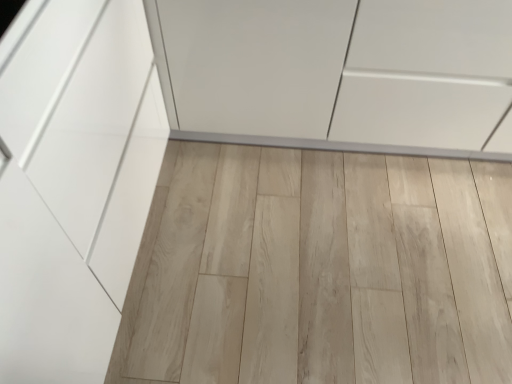
Question: Is white glossy cabinet at center turned away from natural wood plank at center?

Choices:
 (A) yes
 (B) no

Answer: (B)

Question: Is the depth of white glossy cabinet at center less than that of natural wood plank at center?

Choices:
 (A) yes
 (B) no

Answer: (A)

Question: Is white glossy cabinet at center next to natural wood plank at center and touching it?

Choices:
 (A) yes
 (B) no

Answer: (B)

Question: Is white glossy cabinet at center further to camera compared to natural wood plank at center?

Choices:
 (A) yes
 (B) no

Answer: (B)

Question: From a real-world perspective, is white glossy cabinet at center beneath natural wood plank at center?

Choices:
 (A) no
 (B) yes

Answer: (A)

Question: From the image's perspective, is white glossy cabinet at center on top of natural wood plank at center?

Choices:
 (A) no
 (B) yes

Answer: (B)

Question: Considering the relative sizes of natural wood plank at center and white glossy cabinet at center in the image provided, is natural wood plank at center smaller than white glossy cabinet at center?

Choices:
 (A) yes
 (B) no

Answer: (A)

Question: Is natural wood plank at center located outside white glossy cabinet at center?

Choices:
 (A) yes
 (B) no

Answer: (A)

Question: Can you confirm if natural wood plank at center is positioned to the left of white glossy cabinet at center?

Choices:
 (A) no
 (B) yes

Answer: (B)

Question: Could you tell me if natural wood plank at center is turned towards white glossy cabinet at center?

Choices:
 (A) yes
 (B) no

Answer: (B)

Question: Does natural wood plank at center come in front of white glossy cabinet at center?

Choices:
 (A) yes
 (B) no

Answer: (B)

Question: From the image's perspective, is natural wood plank at center above white glossy cabinet at center?

Choices:
 (A) no
 (B) yes

Answer: (A)

Question: Is natural wood plank at center inside or outside of white glossy cabinet at center?

Choices:
 (A) inside
 (B) outside

Answer: (B)